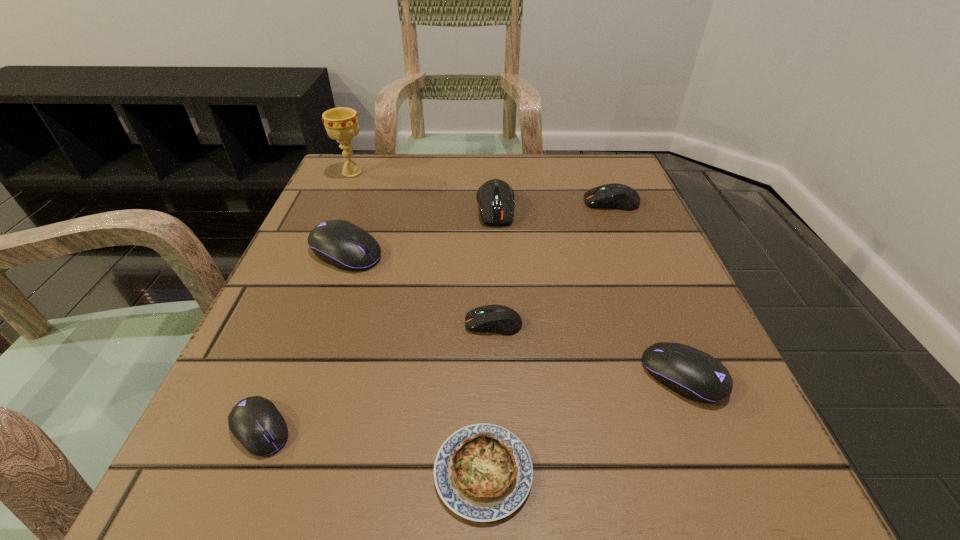
Where is `dark computer equipment that can be found as the second closest to the smallest black computer mouse`? The image size is (960, 540). dark computer equipment that can be found as the second closest to the smallest black computer mouse is located at coordinates point(496,201).

Locate which dark computer equipment ranks second in proximity to the biggest dark computer equipment. Please provide its 2D coordinates. Your answer should be formatted as a tuple, i.e. [(x, y)], where the tuple contains the x and y coordinates of a point satisfying the conditions above.

[(499, 319)]

I want to click on black computer mouse identified as the second closest to the smallest black computer mouse, so click(693, 374).

This screenshot has height=540, width=960. Identify the location of the second closest black computer mouse to the second biggest black computer mouse. (255, 422).

Locate an element on the screen. The height and width of the screenshot is (540, 960). vacant region that satisfies the following two spatial constraints: 1. on the button of the biggest dark computer equipment; 2. on the button of the fourth nearest object is located at coordinates (501, 323).

At what (x,y) coordinates should I click in order to perform the action: click on free space that satisfies the following two spatial constraints: 1. on the button of the second biggest black computer mouse; 2. on the right side of the smallest dark computer equipment. Please return your answer as a coordinate pair (x, y). The height and width of the screenshot is (540, 960). Looking at the image, I should click on (495, 376).

This screenshot has width=960, height=540. Find the location of `free space that satisfies the following two spatial constraints: 1. on the front side of the tallest object; 2. on the right side of the farthest black computer mouse`. free space that satisfies the following two spatial constraints: 1. on the front side of the tallest object; 2. on the right side of the farthest black computer mouse is located at coordinates (317, 252).

The image size is (960, 540). Identify the location of vacant space that satisfies the following two spatial constraints: 1. on the button of the smallest dark computer equipment; 2. on the right side of the rightmost black computer mouse. (495, 376).

Identify the location of vacant space that satisfies the following two spatial constraints: 1. on the button of the rightmost dark computer equipment; 2. on the front side of the shortest object. (721, 472).